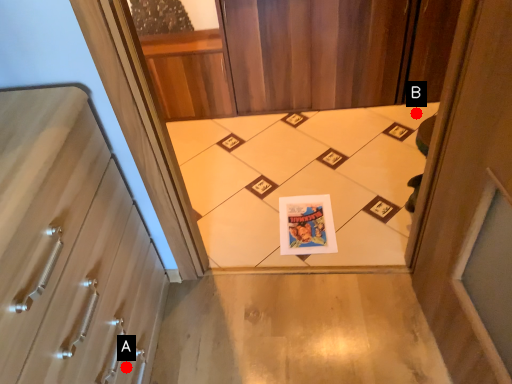
Question: Two points are circled on the image, labeled by A and B beside each circle. Which point is further to the camera?

Choices:
 (A) A is further
 (B) B is further

Answer: (B)